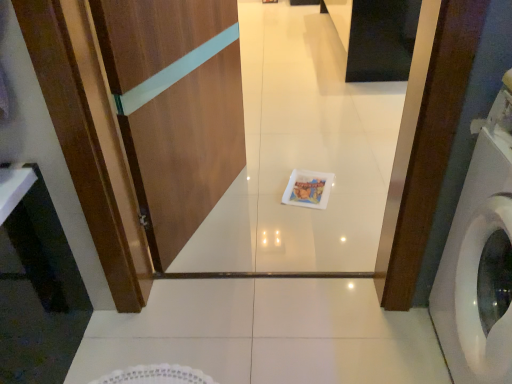
Question: From the image's perspective, is white plastic washing machine at right located above or below black glossy cabinet at upper center?

Choices:
 (A) above
 (B) below

Answer: (B)

Question: In terms of width, does white plastic washing machine at right look wider or thinner when compared to black glossy cabinet at upper center?

Choices:
 (A) thin
 (B) wide

Answer: (A)

Question: Considering the real-world distances, which object is farthest from the white plastic washing machine at right?

Choices:
 (A) wooden screen door at center
 (B) black glossy cabinet at upper center

Answer: (B)

Question: Which is nearer to the black glossy cabinet at upper center?

Choices:
 (A) wooden screen door at center
 (B) white plastic washing machine at right

Answer: (A)